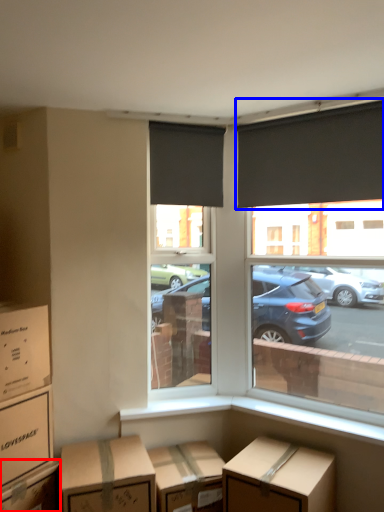
Question: Which object appears closest to the camera in this image, box (highlighted by a red box) or window blind (highlighted by a blue box)?

Choices:
 (A) box
 (B) window blind

Answer: (A)